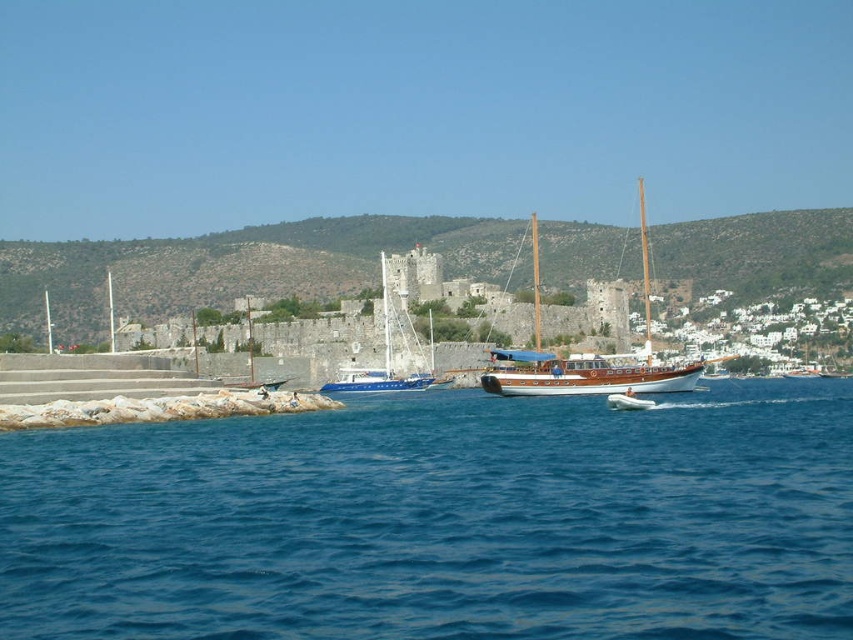
Question: Considering the relative positions of blue water at center and wooden polished sailboat at center in the image provided, where is blue water at center located with respect to wooden polished sailboat at center?

Choices:
 (A) above
 (B) below

Answer: (B)

Question: Which point appears farthest from the camera in this image?

Choices:
 (A) (390, 378)
 (B) (548, 380)

Answer: (A)

Question: Can you confirm if wooden polished sailboat at center is thinner than blue wooden sailboat at center?

Choices:
 (A) yes
 (B) no

Answer: (B)

Question: Which of the following is the farthest from the observer?

Choices:
 (A) (355, 586)
 (B) (654, 381)
 (C) (354, 390)

Answer: (C)

Question: Does wooden polished sailboat at center appear on the right side of blue wooden sailboat at center?

Choices:
 (A) yes
 (B) no

Answer: (A)

Question: Estimate the real-world distances between objects in this image. Which object is closer to the blue water at center?

Choices:
 (A) wooden polished sailboat at center
 (B) blue wooden sailboat at center

Answer: (A)